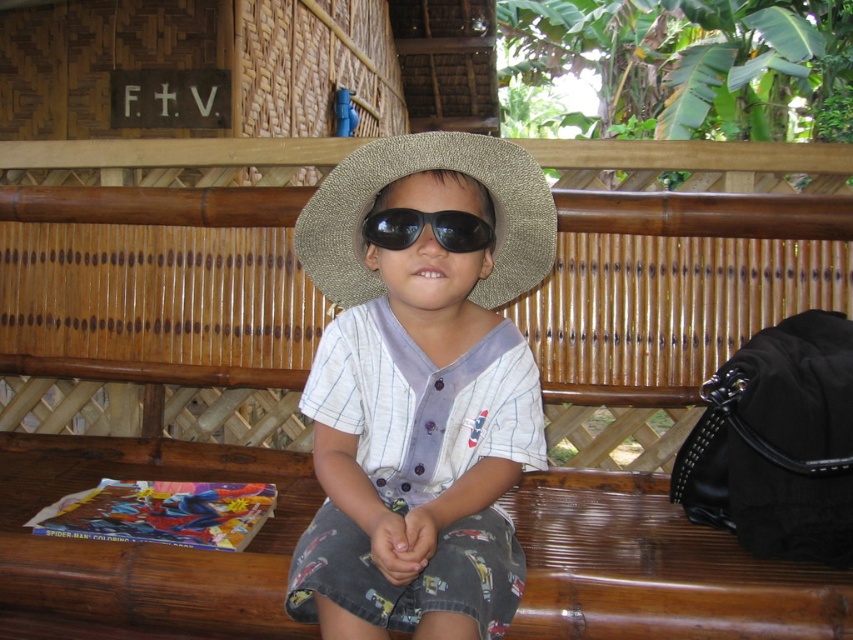
Question: Can you confirm if matte straw hat at center is wider than black matte sunglasses at center?

Choices:
 (A) no
 (B) yes

Answer: (B)

Question: Which of the following is the farthest from the observer?

Choices:
 (A) matte straw hat at center
 (B) natural straw hat at center

Answer: (B)

Question: Is matte straw hat at center thinner than natural straw hat at center?

Choices:
 (A) no
 (B) yes

Answer: (B)

Question: From the image, what is the correct spatial relationship of matte straw hat at center in relation to black matte sunglasses at center?

Choices:
 (A) above
 (B) below

Answer: (B)

Question: Which point is farther to the camera?

Choices:
 (A) (396, 161)
 (B) (404, 209)
 (C) (352, 476)

Answer: (C)

Question: Which of the following is the farthest from the observer?

Choices:
 (A) (354, 301)
 (B) (488, 237)

Answer: (A)